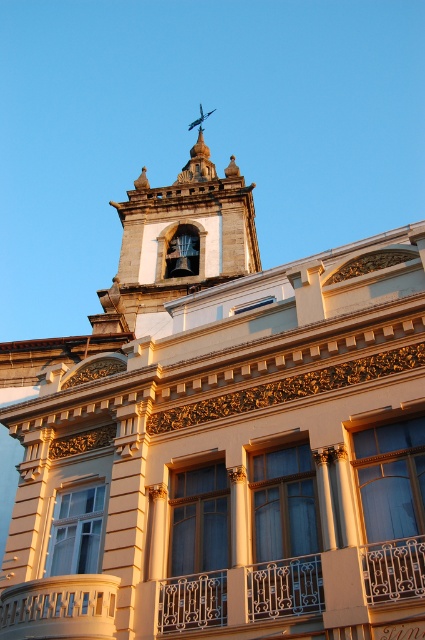
You are standing in front of the building and notice two points marked on the facade. The first point is at coordinates point (39, 628) and the second is at point (147, 273). Which of these points is closer to you?

Point (39, 628) is in front of point (147, 273), so the first point is closer to you.

You are an architect examining the building. You need to install a new light fixture on the gold wrought iron balcony at center. To avoid blocking the view of the dark gray stone bell tower at upper center, where should you position the light fixture?

The gold wrought iron balcony at center is in front of the dark gray stone bell tower at upper center, so positioning the light fixture on the side of the balcony facing away from the bell tower would ensure the view of the bell tower remains unobstructed.

You are an architect examining the building and need to determine the spatial relationship between the gold wrought iron balcony at center and the dark gray stone bell tower at upper center. Which object is located to the right of the other?

The gold wrought iron balcony at center is positioned on the right side of dark gray stone bell tower at upper center.